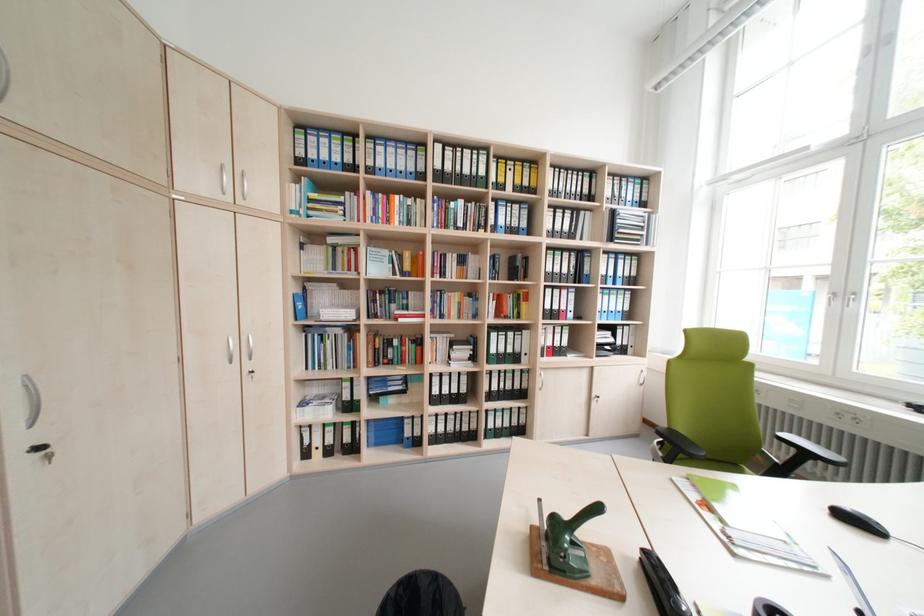
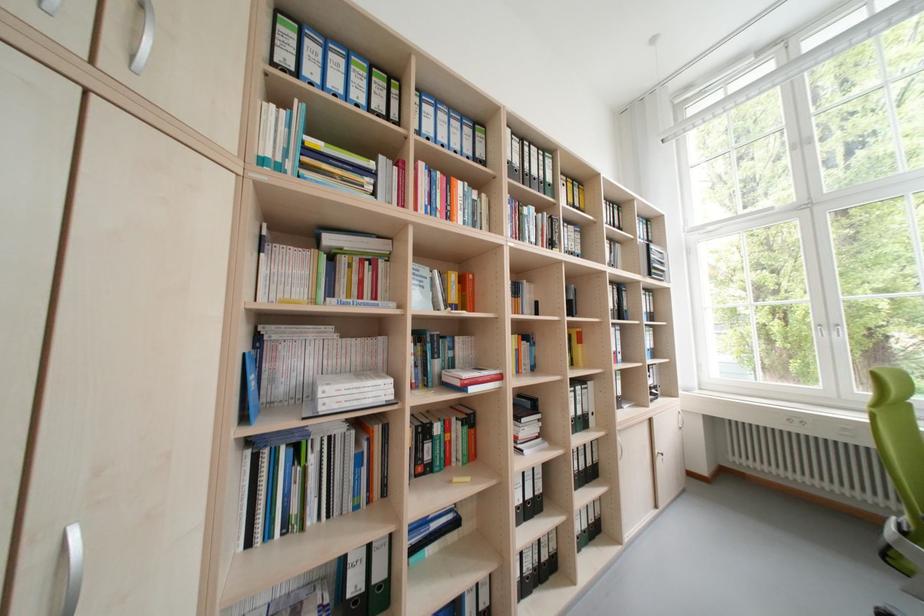
The images are taken continuously from a first-person perspective. In which direction are you moving?

The cameraman moved toward left, forward.